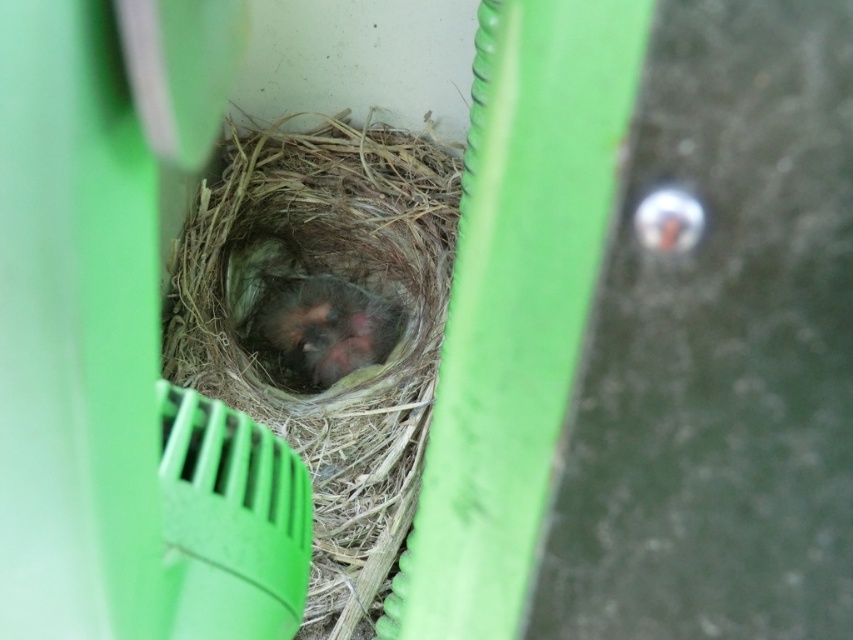
Question: Does brown straw nest at center appear under fluffy downy chicks at center?

Choices:
 (A) no
 (B) yes

Answer: (B)

Question: Is brown straw nest at center in front of fluffy downy chicks at center?

Choices:
 (A) no
 (B) yes

Answer: (B)

Question: Which object appears farthest from the camera in this image?

Choices:
 (A) brown straw nest at center
 (B) fluffy downy chicks at center

Answer: (B)

Question: Which point is closer to the camera?

Choices:
 (A) fluffy downy chicks at center
 (B) brown straw nest at center

Answer: (B)

Question: Among these points, which one is farthest from the camera?

Choices:
 (A) (329, 380)
 (B) (210, 300)

Answer: (A)

Question: Is brown straw nest at center bigger than fluffy downy chicks at center?

Choices:
 (A) no
 (B) yes

Answer: (B)